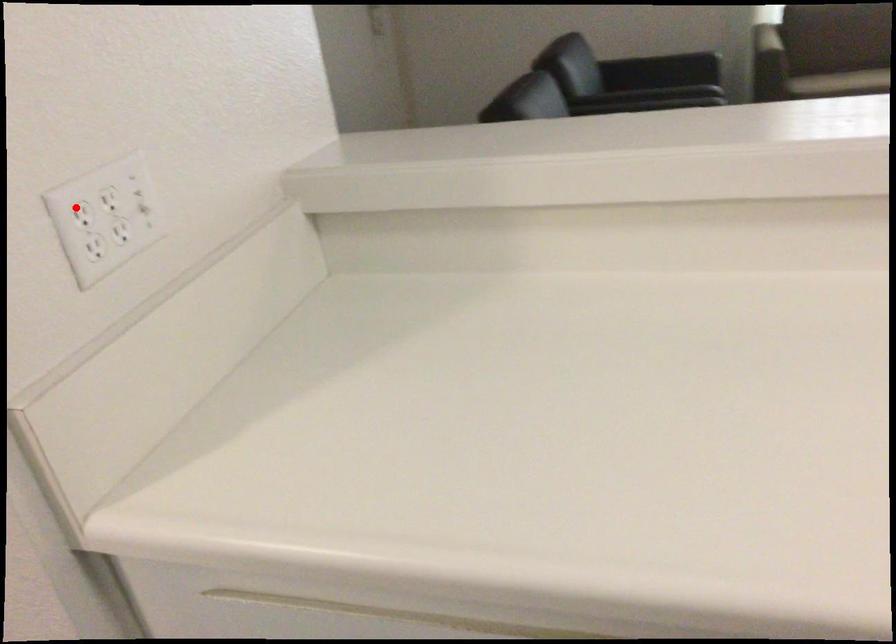
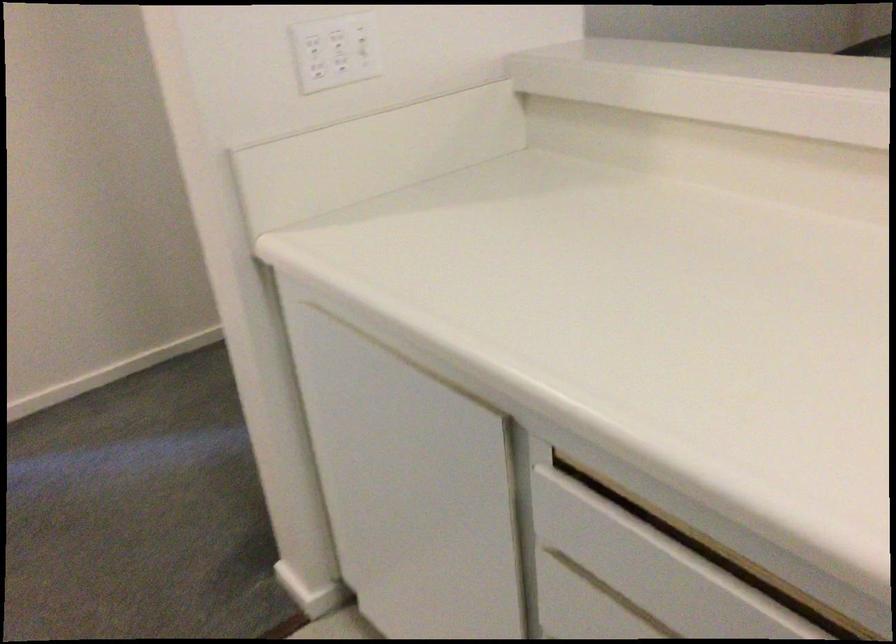
Question: I am providing you with two images of the same scene from different viewpoints. In image1, a red point is highlighted. Considering the same 3D point in image2, which of the following is correct?

Choices:
 (A) It is closer
 (B) It is farther

Answer: (B)